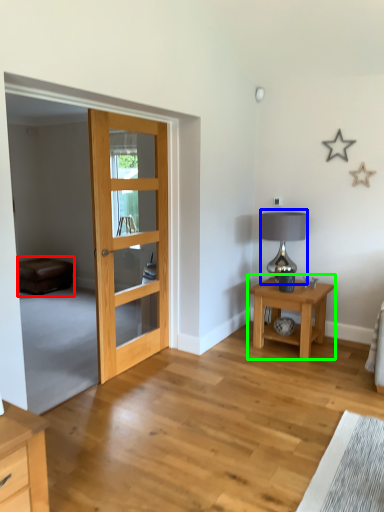
Question: Considering the real-world distances, which object is closest to couch (highlighted by a red box)? table lamp (highlighted by a blue box) or nightstand (highlighted by a green box).

Choices:
 (A) table lamp
 (B) nightstand

Answer: (A)